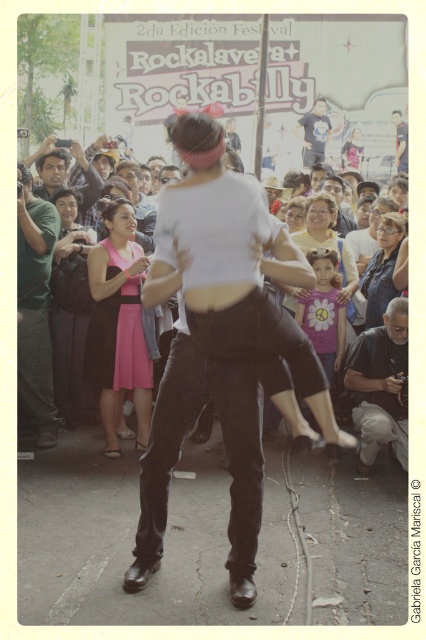
You are a photographer at the festival and want to capture a shot of the black cotton shirt at lower right and the dark blue fabric at center. Which object is closer to the camera?

The black cotton shirt at lower right is closer to the camera because it is in front of the dark blue fabric at center.

You are at the festival and see the matte black dress at left and the black cotton shirt at lower right. Which clothing item is located more to the left side of the scene?

The matte black dress at left is more to the left side of the scene than the black cotton shirt at lower right.